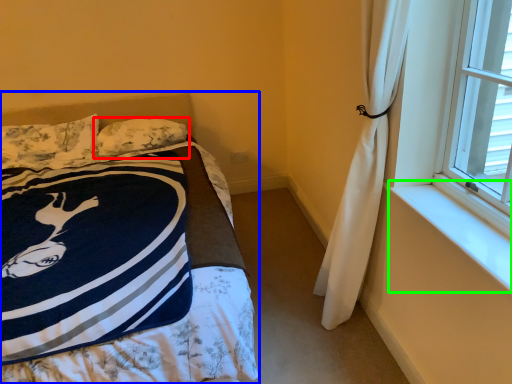
Question: Estimate the real-world distances between objects in this image. Which object is farther from pillow (highlighted by a red box), bed (highlighted by a blue box) or window sill (highlighted by a green box)?

Choices:
 (A) bed
 (B) window sill

Answer: (B)